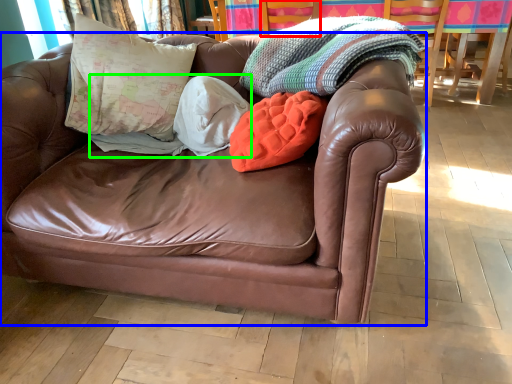
Question: Considering the real-world distances, which object is farthest from armchair (highlighted by a red box)? studio couch (highlighted by a blue box) or blanket (highlighted by a green box)?

Choices:
 (A) studio couch
 (B) blanket

Answer: (A)